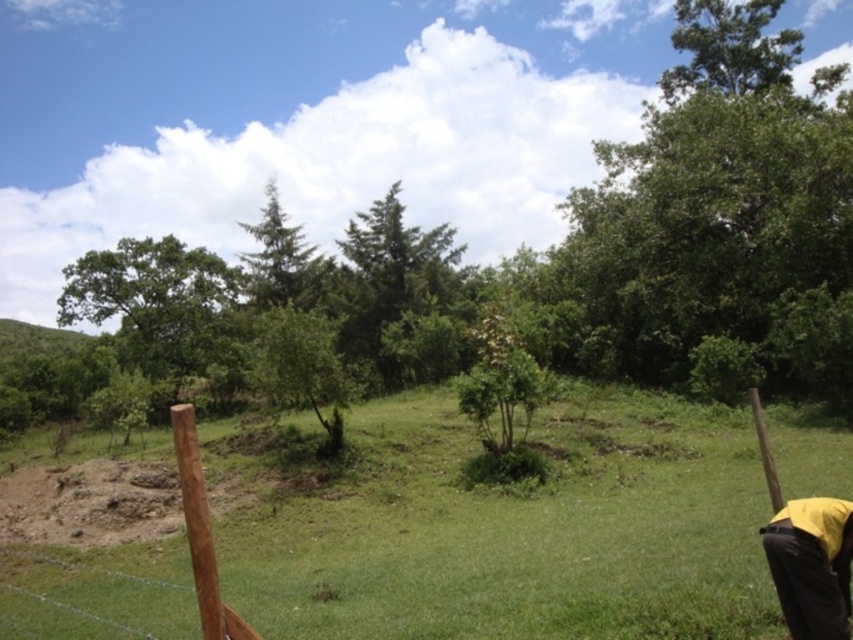
Who is positioned more to the left, green grassy at center or green matte tree at center?

From the viewer's perspective, green matte tree at center appears more on the left side.

Who is taller, green grassy at center or green matte tree at center?

green matte tree at center is taller.

Image resolution: width=853 pixels, height=640 pixels. I want to click on green grassy at center, so click(495, 525).

Is point (430, 509) closer to viewer compared to point (814, 608)?

No, (430, 509) is behind (814, 608).

Which is more to the right, green grassy at center or black/yellow jacket at lower right?

black/yellow jacket at lower right

Consider the image. Who is more forward, (711,477) or (770,538)?

Point (770,538) is more forward.

The width and height of the screenshot is (853, 640). I want to click on green grassy at center, so click(495, 525).

Does point (123, 472) come closer to viewer compared to point (204, 609)?

That is False.

Who is higher up, green grassy at center or brown wooden post at lower left?

brown wooden post at lower left is above.

Who is more forward, (761, 589) or (183, 444)?

Positioned in front is point (183, 444).

The image size is (853, 640). Identify the location of green grassy at center. (495, 525).